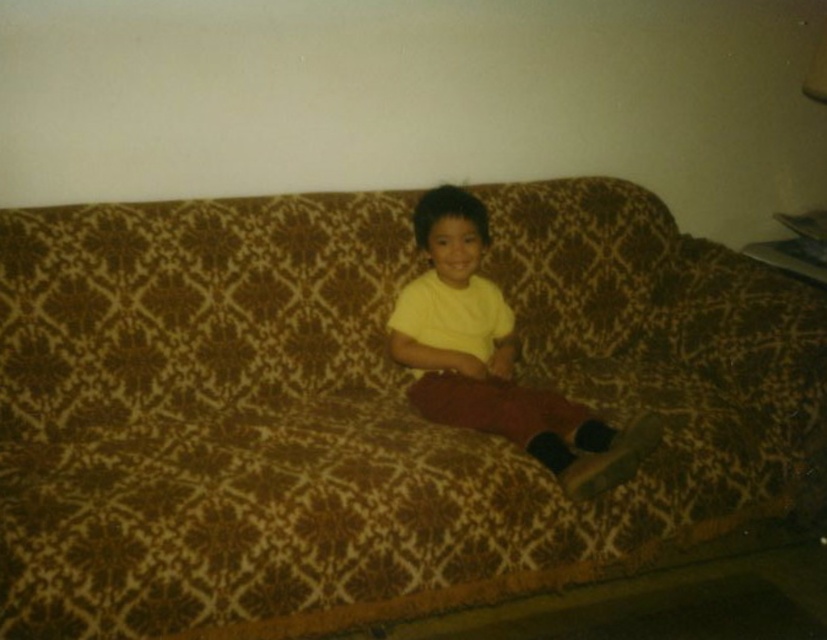
You are a photographer setting up a shoot. You want to position a reflector to the right of the yellow matte shirt at center to bounce light onto the child. Given the current setup, will the reflector be placed to the left or right of the brown textured couch at center?

The brown textured couch at center is to the left of yellow matte shirt at center. Therefore, placing the reflector to the right of the yellow matte shirt at center would position it to the right of the brown textured couch at center as well.

You are a photographer trying to capture the child sitting on the brown textured couch at center. You want to place a small prop exactly at the point with coordinates point (362, 408). According to the image, will this point be on the couch?

Yes, the point (362, 408) is on the brown textured couch at center, so placing the prop there will position it on the couch.

Based on the photo, you are a photographer setting up a shoot. You need to position a camera on a tripod so that both the brown textured couch at center and the yellow matte shirt at center are in focus. Considering their heights, which object should the camera focus on first to ensure both are in focus?

The camera should focus on the brown textured couch at center first since it has a greater height compared to the yellow matte shirt at center, ensuring both are in focus.